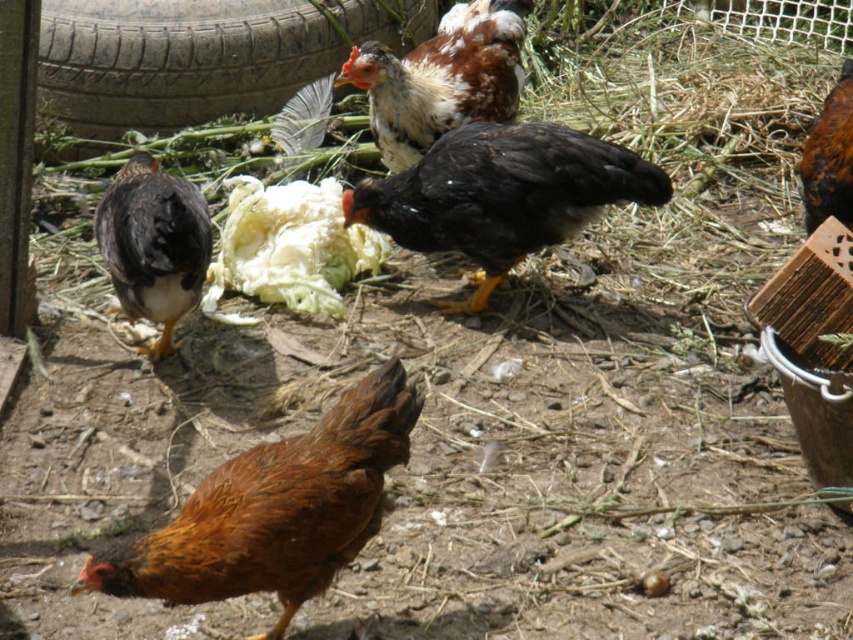
Can you confirm if rubber tire at upper left is positioned below brown speckled feathers at center?

Actually, rubber tire at upper left is above brown speckled feathers at center.

Does point (201, 67) come behind point (442, 109)?

Yes, point (201, 67) is farther from viewer.

The image size is (853, 640). In order to click on rubber tire at upper left in this screenshot , I will do `click(199, 54)`.

Between matte black chicken at left and brown feathered chicken at right, which one is positioned higher?

brown feathered chicken at right is higher up.

Is matte black chicken at left below brown feathered chicken at right?

Correct, matte black chicken at left is located below brown feathered chicken at right.

Does point (108, 200) come closer to viewer compared to point (833, 96)?

Yes.

The width and height of the screenshot is (853, 640). Identify the location of matte black chicken at left. (154, 244).

Is white crisp cabbage at center wider than matte black chicken at left?

Yes.

Which is in front, point (358, 262) or point (122, 236)?

Point (122, 236) is in front.

Which is behind, point (318, 228) or point (136, 218)?

The point (318, 228) is more distant.

Find the location of a particular element. This screenshot has height=640, width=853. white crisp cabbage at center is located at coordinates (288, 248).